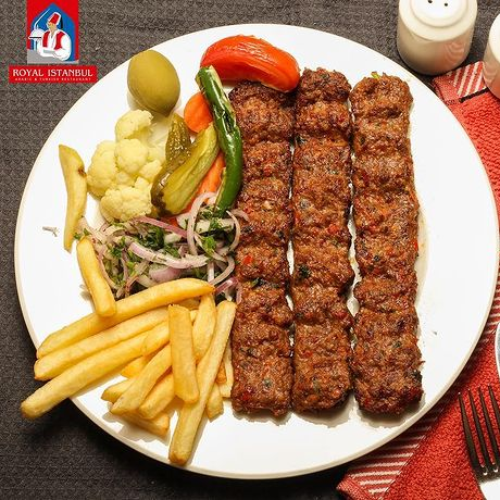
Identify the location of napkin. (445, 463).